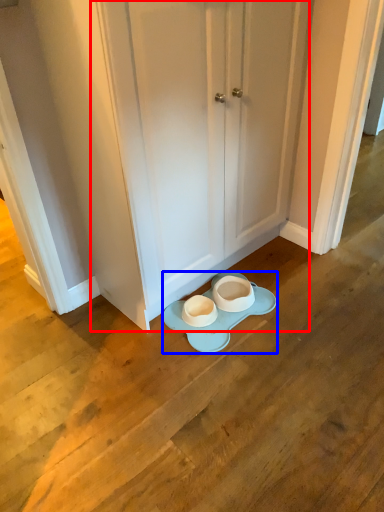
Question: Which of the following is the closest to the observer, door (highlighted by a red box) or porcelain (highlighted by a blue box)?

Choices:
 (A) door
 (B) porcelain

Answer: (A)